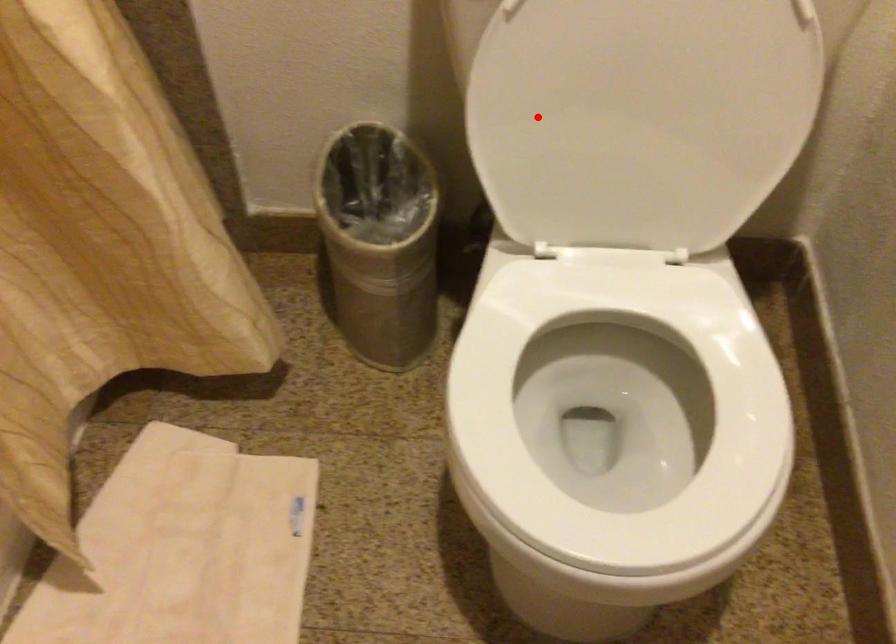
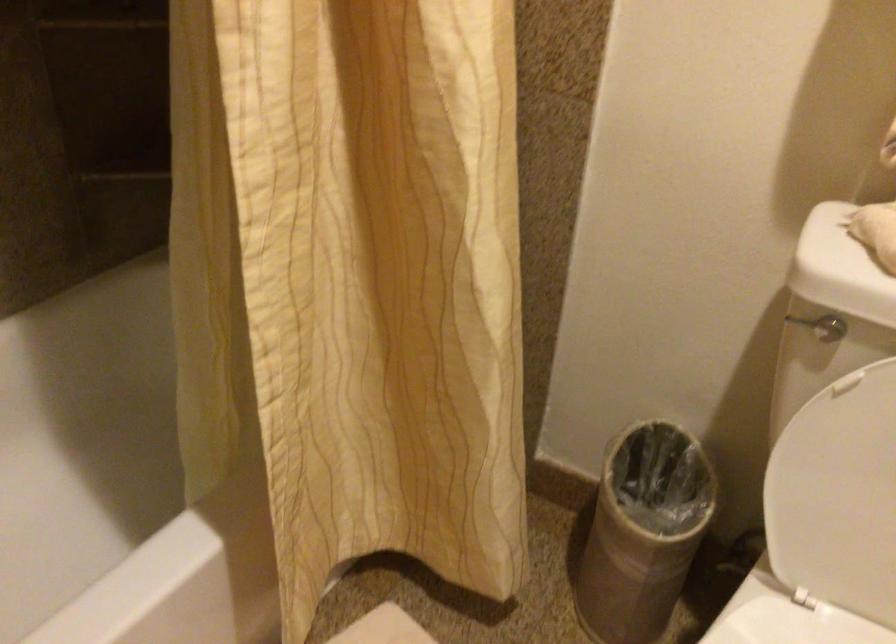
The point at the highlighted location is marked in the first image. Where is the corresponding point in the second image?

(834, 480)